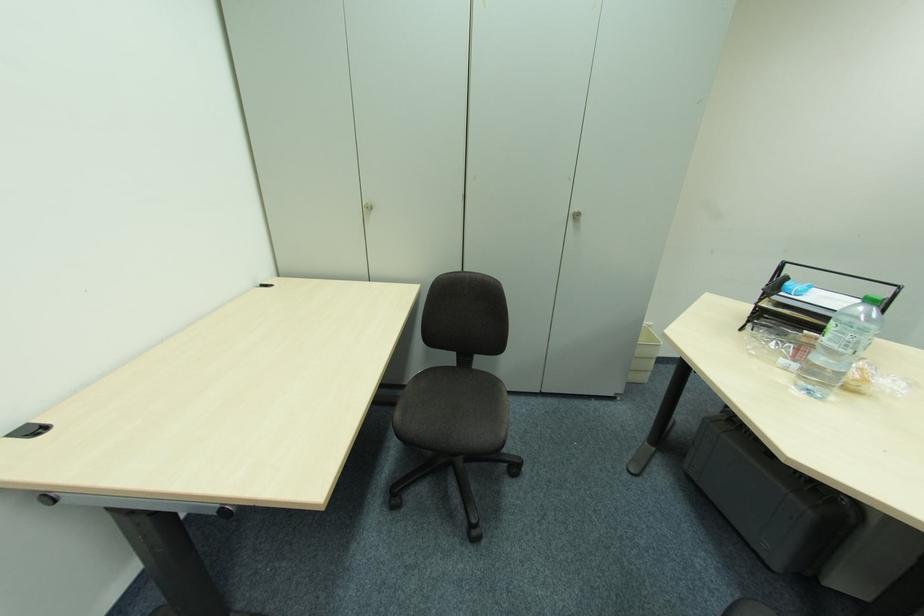
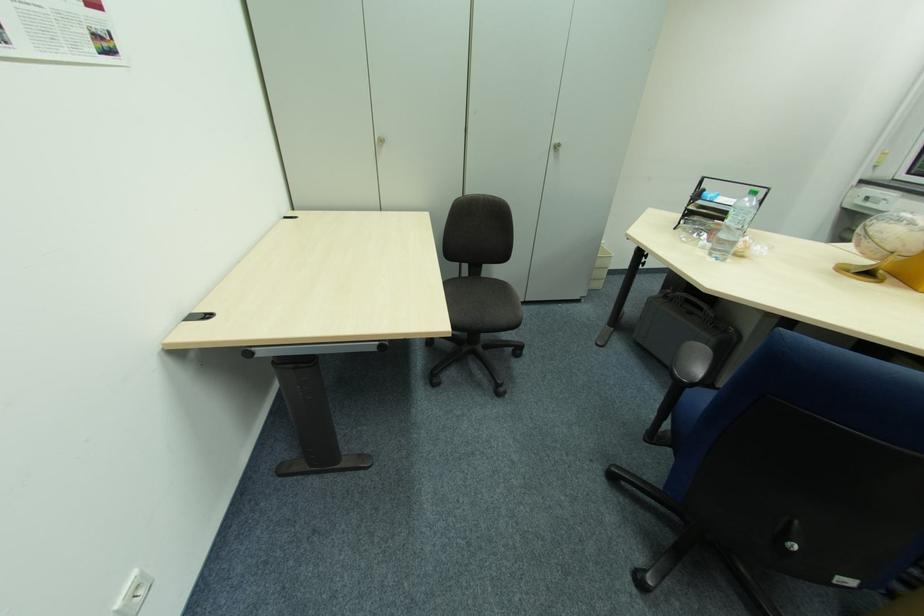
Find the pixel in the second image that matches [574,219] in the first image.

(554, 150)